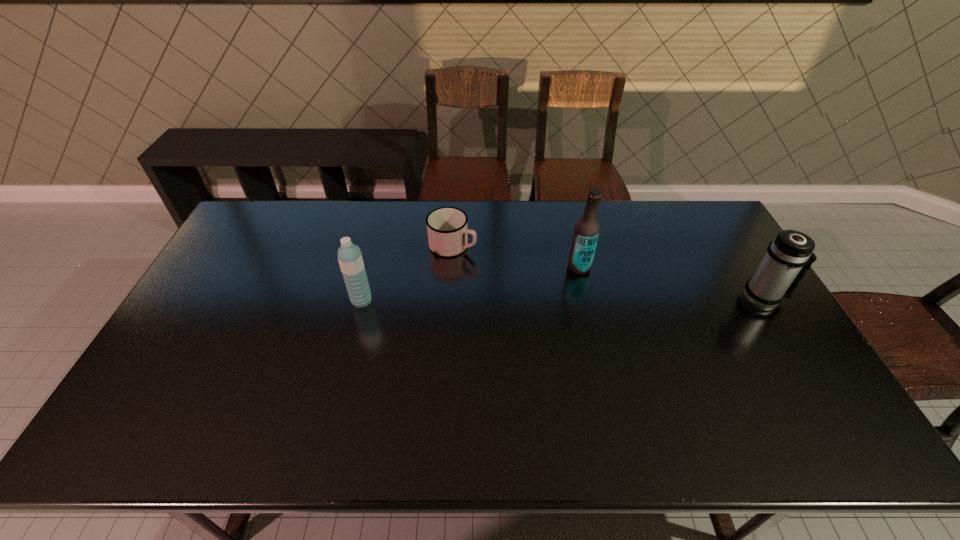
Locate an element on the screen. This screenshot has width=960, height=540. free space located on the side of the farthest object with the handle is located at coordinates (548, 282).

This screenshot has height=540, width=960. In order to click on free space located 0.330m on the side of the farthest object with the handle in this screenshot , I will do `click(564, 288)`.

I want to click on vacant region located on the side of the farthest object with the handle, so click(561, 287).

Identify the location of object that is at the far edge. Image resolution: width=960 pixels, height=540 pixels. (447, 229).

Identify the location of object at the right edge. This screenshot has width=960, height=540. (775, 278).

Locate an element on the screen. free location at the far edge of the desktop is located at coordinates (389, 224).

The image size is (960, 540). Identify the location of free space at the near edge of the desktop. (456, 407).

In the image, there is a desktop. Find the location of `vacant space at the left edge`. vacant space at the left edge is located at coordinates (195, 308).

Identify the location of free space at the right edge of the desktop. Image resolution: width=960 pixels, height=540 pixels. (773, 373).

What are the coordinates of `free space between the second object from left to right and the leftmost object` in the screenshot? It's located at (407, 273).